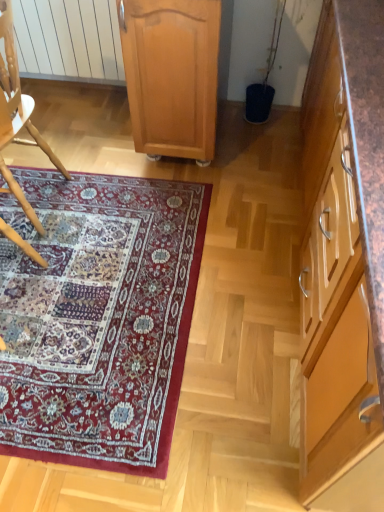
Question: In the image, is carpet with intricate patterns at lower left on the left side or the right side of light brown wood cabinet at center, which is the first cabinetry from left to right?

Choices:
 (A) right
 (B) left

Answer: (B)

Question: Does point (105, 351) appear closer or farther from the camera than point (148, 35)?

Choices:
 (A) farther
 (B) closer

Answer: (B)

Question: Which is farther from the brown wood cabinet at right, the 2th cabinetry positioned from the left?

Choices:
 (A) wooden chair at left
 (B) carpet with intricate patterns at lower left
 (C) light brown wood cabinet at center, arranged as the 2th cabinetry when viewed from the right

Answer: (A)

Question: Considering the real-world distances, which object is farthest from the wooden chair at left?

Choices:
 (A) light brown wood cabinet at center, which is the first cabinetry from left to right
 (B) brown wood cabinet at right, the 2th cabinetry positioned from the left
 (C) carpet with intricate patterns at lower left

Answer: (B)